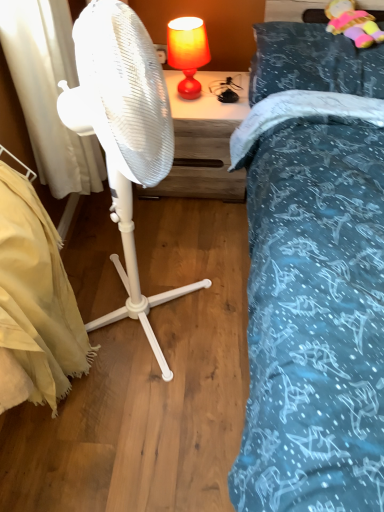
Question: Considering the relative positions of teal fabric pillow at upper right and white fabric curtain at left in the image provided, is teal fabric pillow at upper right to the right of white fabric curtain at left from the viewer's perspective?

Choices:
 (A) no
 (B) yes

Answer: (B)

Question: Considering the relative sizes of teal fabric pillow at upper right and white fabric curtain at left in the image provided, is teal fabric pillow at upper right wider than white fabric curtain at left?

Choices:
 (A) yes
 (B) no

Answer: (A)

Question: Can you confirm if teal fabric pillow at upper right is bigger than white fabric curtain at left?

Choices:
 (A) yes
 (B) no

Answer: (B)

Question: Does teal fabric pillow at upper right have a lesser height compared to white fabric curtain at left?

Choices:
 (A) yes
 (B) no

Answer: (A)

Question: Is teal fabric pillow at upper right closer to the viewer compared to white fabric curtain at left?

Choices:
 (A) no
 (B) yes

Answer: (A)

Question: From the image's perspective, is teal fabric pillow at upper right on top of white fabric curtain at left?

Choices:
 (A) no
 (B) yes

Answer: (B)

Question: Is white plastic fan at center not within beige fabric mattress at lower left?

Choices:
 (A) no
 (B) yes

Answer: (B)

Question: Is white plastic fan at center behind beige fabric mattress at lower left?

Choices:
 (A) no
 (B) yes

Answer: (A)

Question: Are white plastic fan at center and beige fabric mattress at lower left far apart?

Choices:
 (A) yes
 (B) no

Answer: (B)

Question: From the image's perspective, would you say white plastic fan at center is shown under beige fabric mattress at lower left?

Choices:
 (A) yes
 (B) no

Answer: (B)

Question: Is beige fabric mattress at lower left inside white plastic fan at center?

Choices:
 (A) no
 (B) yes

Answer: (A)

Question: From a real-world perspective, is white plastic fan at center under beige fabric mattress at lower left?

Choices:
 (A) no
 (B) yes

Answer: (A)

Question: Is white plastic fan at center located outside matte orange lampshade at upper center?

Choices:
 (A) no
 (B) yes

Answer: (B)